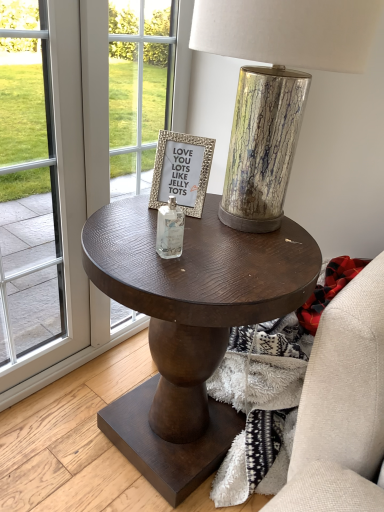
Where is `free space to the left of gold textured frame at center`? This screenshot has width=384, height=512. free space to the left of gold textured frame at center is located at coordinates (126, 207).